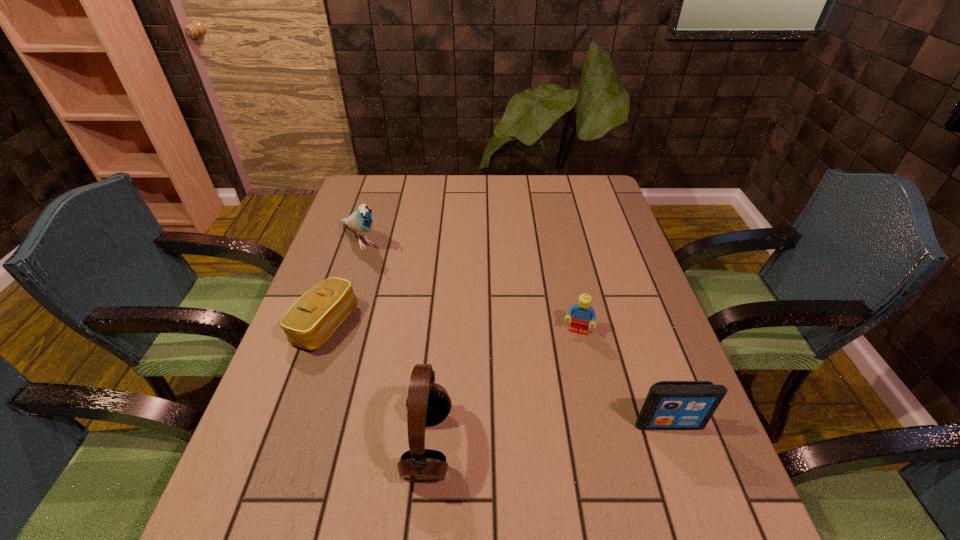
This screenshot has height=540, width=960. Find the location of `free spot on the desktop that is between the third object from left to right and the iPod and is positioned on the face of the Lego`. free spot on the desktop that is between the third object from left to right and the iPod and is positioned on the face of the Lego is located at coordinates (553, 434).

You are a GUI agent. You are given a task and a screenshot of the screen. Output one action in this format:
    pyautogui.click(x=<x>, y=<y>)
    Task: Click on the free spot on the desktop that is between the headset and the iPod and is positioned at the face of the farthest object
    This screenshot has height=540, width=960.
    Given the screenshot: What is the action you would take?
    pyautogui.click(x=557, y=434)

Find the location of a particular element. free space on the desktop that is between the headset and the rightmost object and is positioned on the zipper side of the clutch bag is located at coordinates (569, 433).